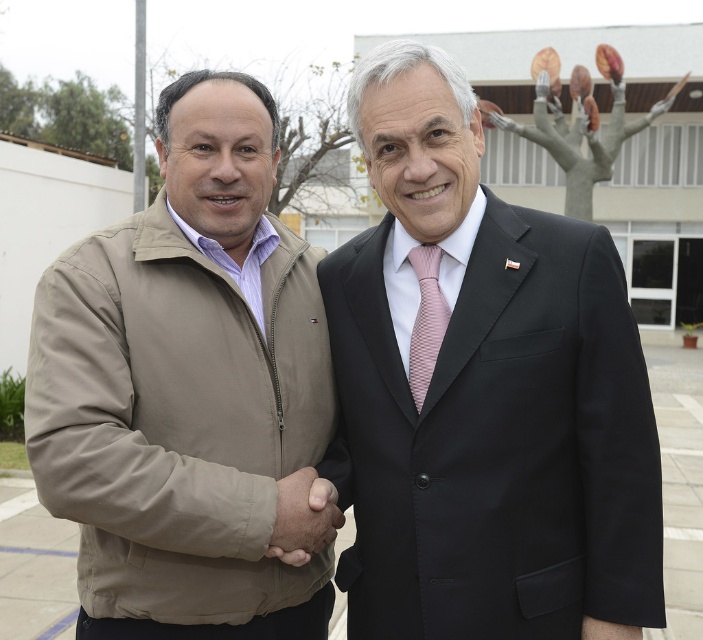
You are standing at the point with coordinates (303, 516) in the image. What object are you standing on?

You are standing on the brown leather hand at center.

You are a photographer standing at the center of the scene. You need to capture a closeup shot of the tan softshell jacket at left. Which direction should you move to get closer to it?

You should move to the left to get closer to the tan softshell jacket at left since it is located at point (186, 387), which is on the left side of the scene.

Looking at this image, you are a photographer trying to frame a shot of the two people shaking hands. The brown leather hand at center and the pink woven tie at center are both in your viewfinder. Which object is wider when viewed from your perspective?

The brown leather hand at center is wider than the pink woven tie at center.